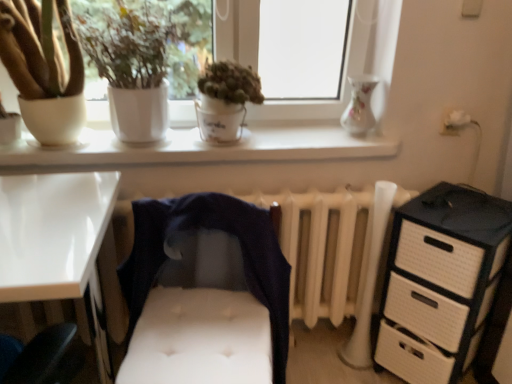
I want to click on free space above white woven chest of drawers at right (from a real-world perspective), so pyautogui.click(x=465, y=210).